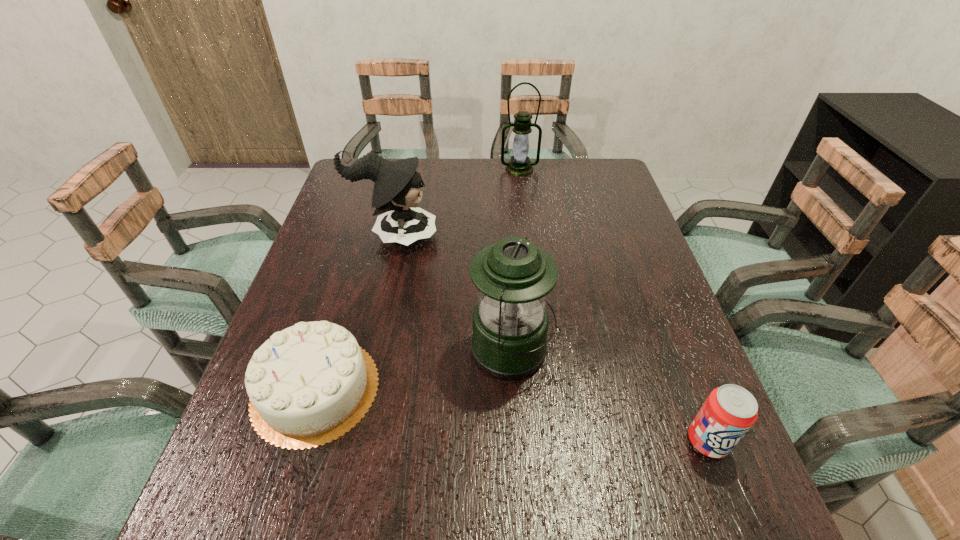
This screenshot has width=960, height=540. I want to click on vacant region between the rightmost object and the birthday cake, so click(x=512, y=415).

At what (x,y) coordinates should I click in order to perform the action: click on vacant region between the farthest object and the birthday cake. Please return your answer as a coordinate pair (x, y). The height and width of the screenshot is (540, 960). Looking at the image, I should click on (418, 279).

I want to click on vacant space that's between the nearer lantern and the birthday cake, so click(414, 370).

This screenshot has height=540, width=960. Find the location of `free space between the fourth nearest object and the soda can`. free space between the fourth nearest object and the soda can is located at coordinates [x=551, y=339].

The width and height of the screenshot is (960, 540). In order to click on vacant region between the rightmost object and the second farthest object in this screenshot , I will do `click(551, 339)`.

Locate an element on the screen. This screenshot has height=540, width=960. free spot between the farthest object and the birthday cake is located at coordinates (418, 279).

At what (x,y) coordinates should I click in order to perform the action: click on free space between the birthday cake and the nearer lantern. Please return your answer as a coordinate pair (x, y). Looking at the image, I should click on (414, 370).

Locate an element on the screen. vacant area that lies between the birthday cake and the doll is located at coordinates (355, 313).

This screenshot has width=960, height=540. Find the location of `free space that is in between the birthday cake and the soda can`. free space that is in between the birthday cake and the soda can is located at coordinates (512, 415).

Select which object is the fourth closest to the farther lantern. Please provide its 2D coordinates. Your answer should be formatted as a tuple, i.e. [(x, y)], where the tuple contains the x and y coordinates of a point satisfying the conditions above.

[(728, 413)]